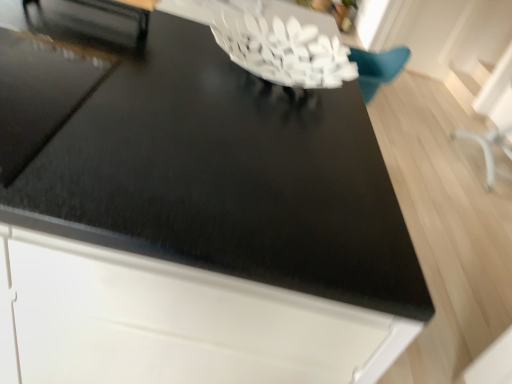
Measure the distance between black granite countertop at center and camera.

The depth of black granite countertop at center is 22.21 inches.

Find the location of a particular element. The width and height of the screenshot is (512, 384). black granite countertop at center is located at coordinates (196, 158).

This screenshot has width=512, height=384. Describe the element at coordinates (196, 158) in the screenshot. I see `black granite countertop at center` at that location.

Locate an element on the screen. Image resolution: width=512 pixels, height=384 pixels. black granite countertop at center is located at coordinates (196, 158).